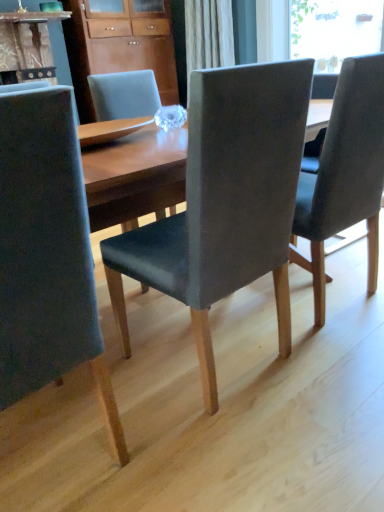
Where is `free location to the right of matte gray chair at left, which appears as the third chair when viewed from the right`? The height and width of the screenshot is (512, 384). free location to the right of matte gray chair at left, which appears as the third chair when viewed from the right is located at coordinates (183, 444).